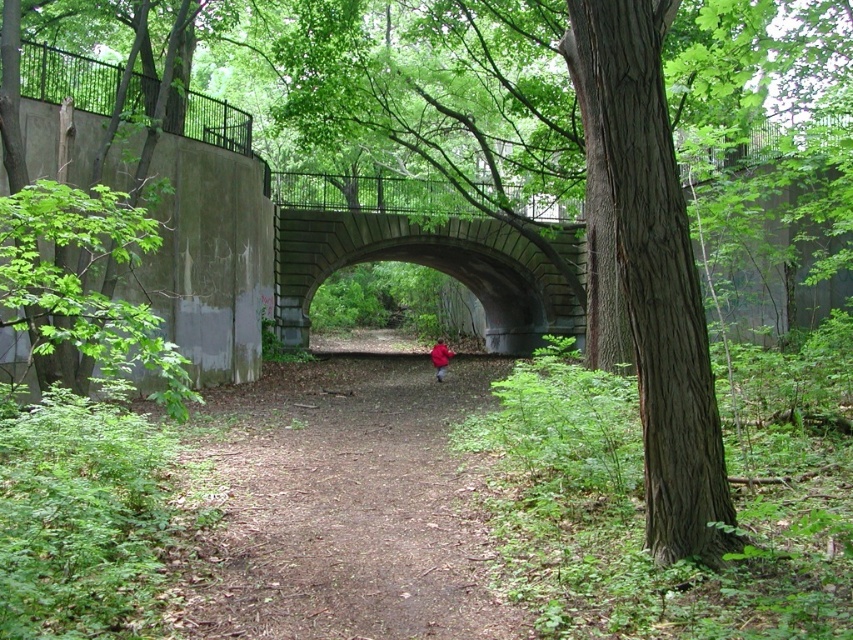
Question: Which object is the farthest from the green textured bark tree at right?

Choices:
 (A) brown dirt path at center
 (B) red matte jacket at center
 (C) stone arch bridge at center

Answer: (C)

Question: Does green textured bark tree at right appear on the left side of red matte jacket at center?

Choices:
 (A) no
 (B) yes

Answer: (A)

Question: Which point is closer to the camera taking this photo?

Choices:
 (A) [x=350, y=493]
 (B) [x=437, y=353]

Answer: (A)

Question: Does green textured bark tree at right have a lesser width compared to red matte jacket at center?

Choices:
 (A) yes
 (B) no

Answer: (A)

Question: Can you confirm if stone arch bridge at center is bigger than red matte jacket at center?

Choices:
 (A) no
 (B) yes

Answer: (B)

Question: Which of these objects is positioned farthest from the red matte jacket at center?

Choices:
 (A) green textured bark tree at right
 (B) brown dirt path at center

Answer: (A)